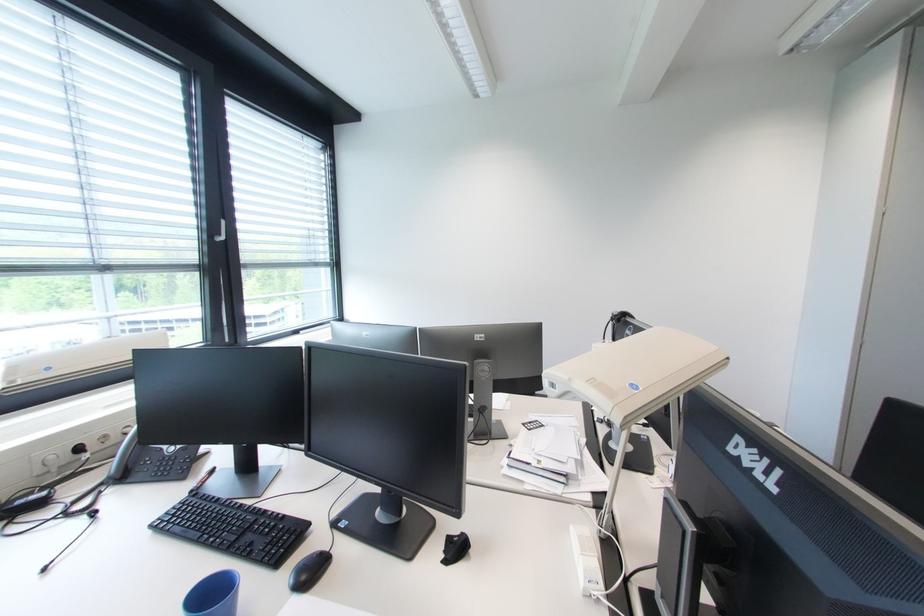
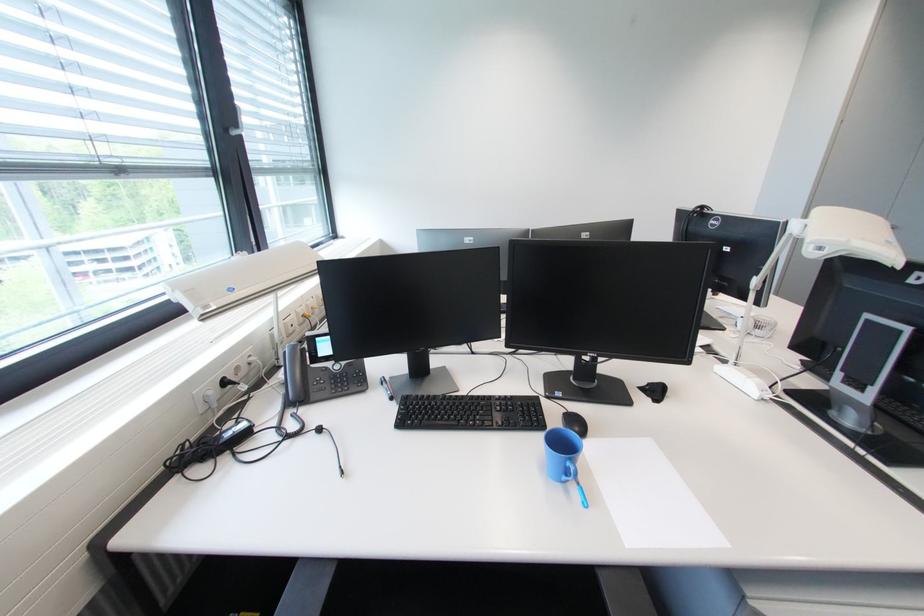
Find the pixel in the second image that matches [290,517] in the first image.

(517, 398)